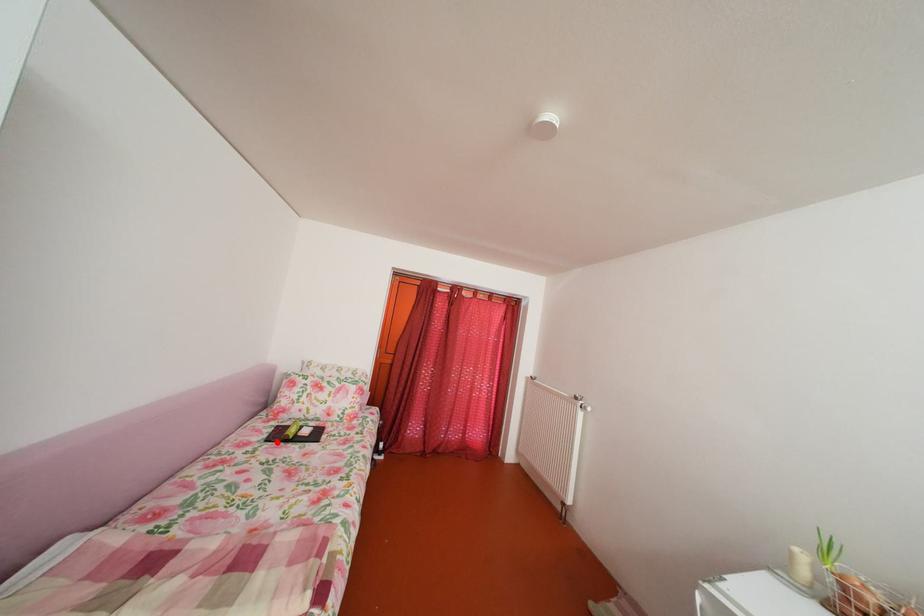
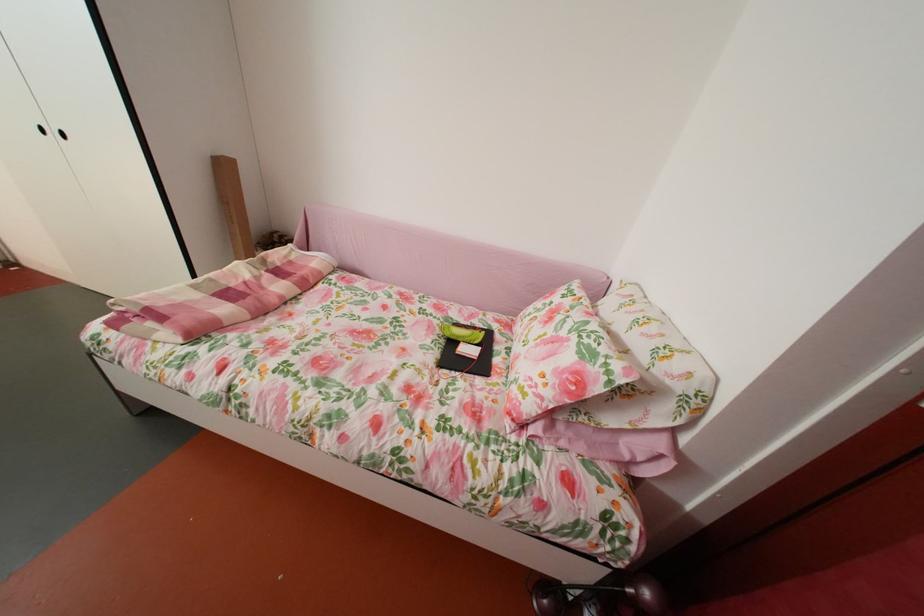
Where in the second image is the point corresponding to the highlighted location from the first image?

(473, 328)